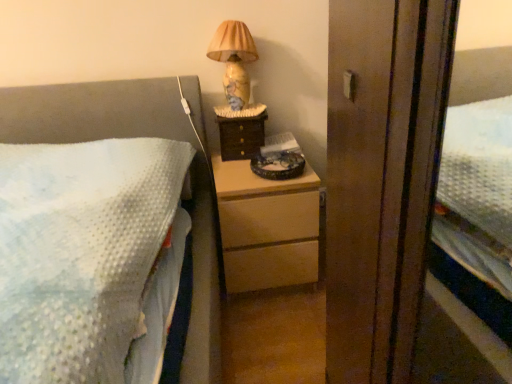
Where is `free point above wooden drawer at center (from a real-world perspective)`? free point above wooden drawer at center (from a real-world perspective) is located at coordinates (240, 109).